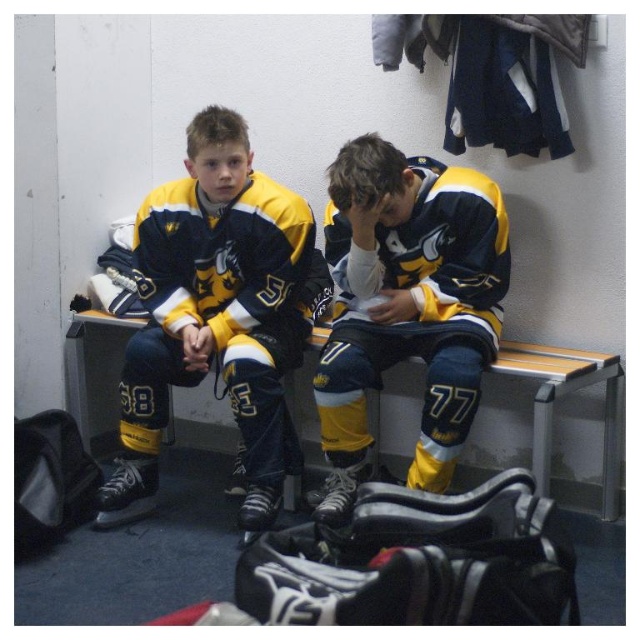
Question: Can you confirm if matte hockey jersey at center is thinner than matte yellow hockey jersey at center?

Choices:
 (A) no
 (B) yes

Answer: (A)

Question: Which of the following is the closest to the observer?

Choices:
 (A) matte yellow hockey jersey at center
 (B) wooden bench at center
 (C) matte hockey jersey at center

Answer: (A)

Question: Which point is closer to the camera?

Choices:
 (A) (179, 237)
 (B) (504, 220)

Answer: (B)

Question: Does matte hockey jersey at center appear on the left side of matte yellow hockey jersey at center?

Choices:
 (A) no
 (B) yes

Answer: (B)

Question: Which point is closer to the camera?

Choices:
 (A) matte hockey jersey at center
 (B) matte yellow hockey jersey at center
 (C) wooden bench at center

Answer: (B)

Question: From the image, what is the correct spatial relationship of matte hockey jersey at center in relation to matte yellow hockey jersey at center?

Choices:
 (A) left
 (B) right

Answer: (A)